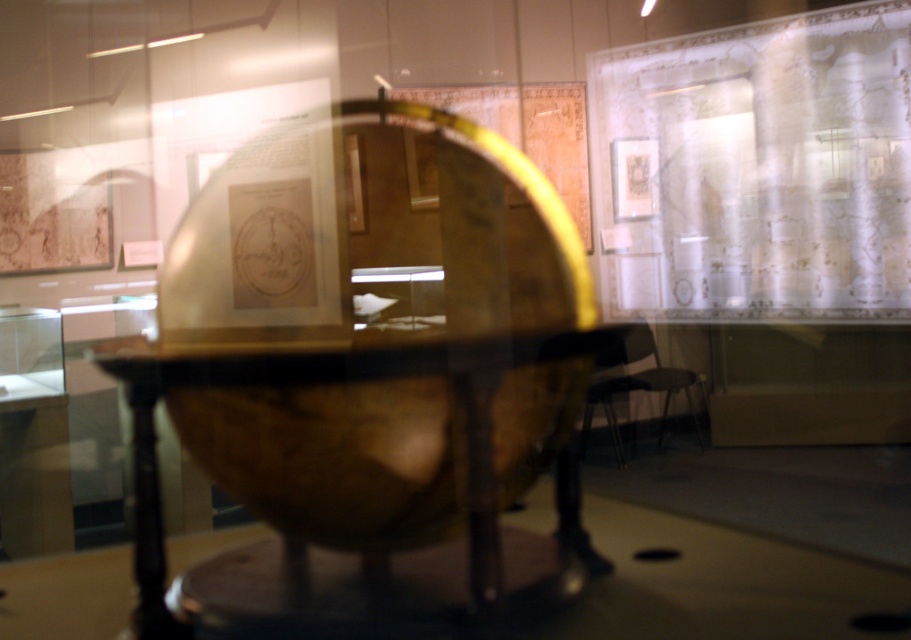
Does transparent wood globe at center have a lesser height compared to matte black chair at center?

In fact, transparent wood globe at center may be taller than matte black chair at center.

Who is taller, transparent wood globe at center or matte black chair at center?

With more height is transparent wood globe at center.

Where is `transparent wood globe at center`? The height and width of the screenshot is (640, 911). transparent wood globe at center is located at coordinates (331, 381).